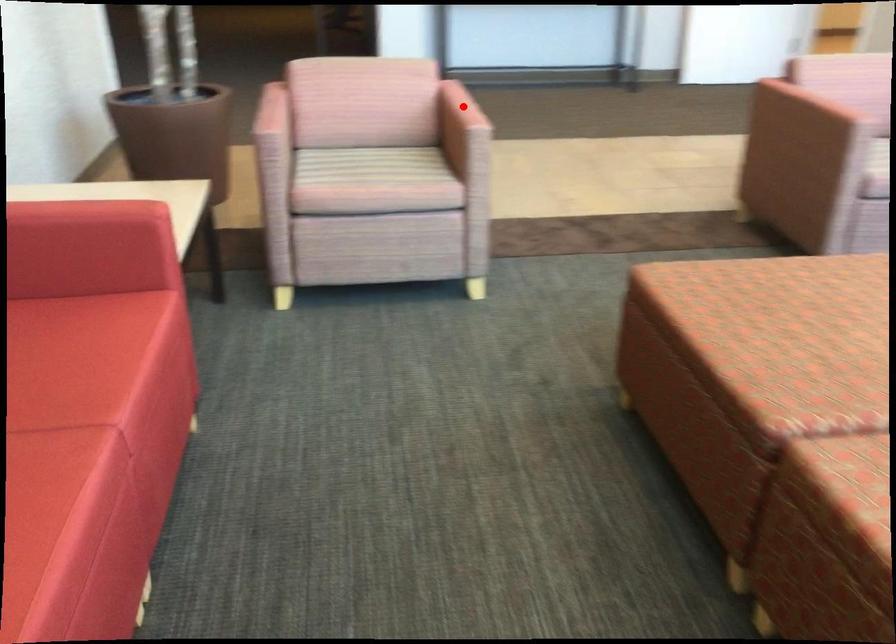
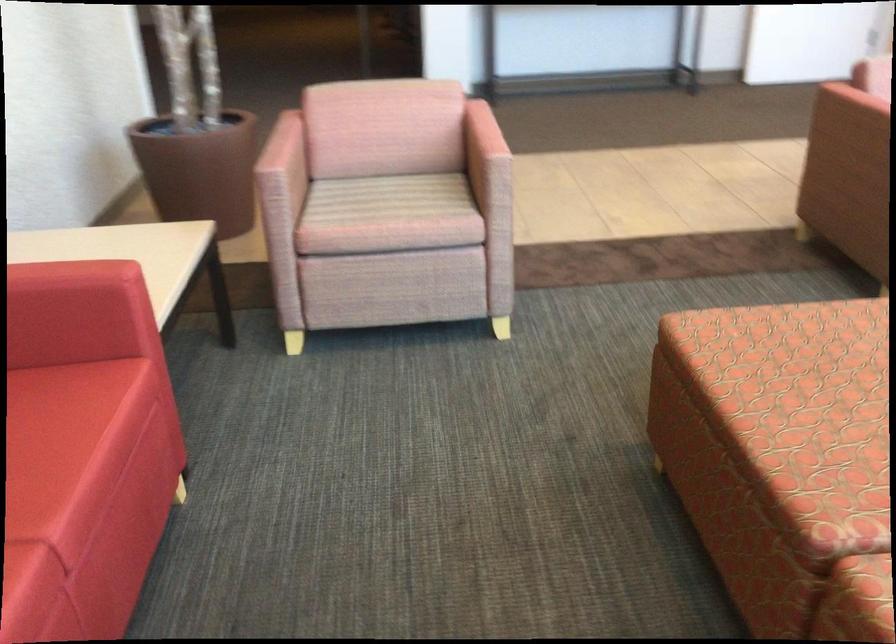
Find the pixel in the second image that matches the highlighted location in the first image.

(481, 133)